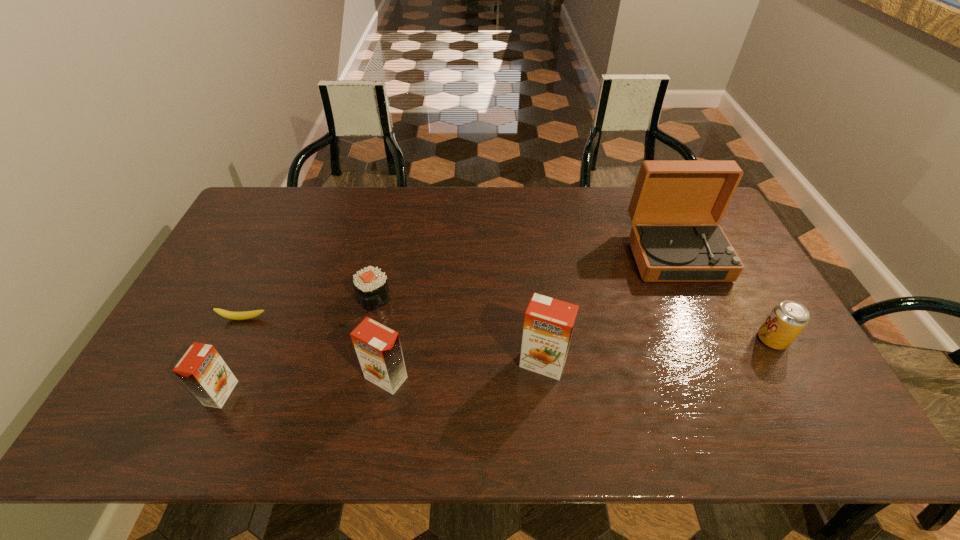
Where is `banana`? This screenshot has width=960, height=540. banana is located at coordinates (245, 315).

Where is `the third farthest object`? The image size is (960, 540). the third farthest object is located at coordinates (245, 315).

Where is `free region located on the back of the leftmost orange juice`? Image resolution: width=960 pixels, height=540 pixels. free region located on the back of the leftmost orange juice is located at coordinates (269, 288).

Identify the location of free space located on the left of the second orange juice from left to right. (254, 377).

Identify the location of blank space located on the left of the third object from right to left. This screenshot has height=540, width=960. (431, 363).

Identify the location of vacant space located 0.310m on the face of the phonograph record. (731, 376).

You are a GUI agent. You are given a task and a screenshot of the screen. Output one action in this format:
    pyautogui.click(x=<x>, y=<y>)
    Task: Click on the free location located on the back of the fifth tallest object
    
    Given the screenshot: What is the action you would take?
    [x=715, y=238]

Locate an element on the screen. vacant space located 0.190m on the back of the sushi is located at coordinates (387, 242).

Find the location of a particular element. Image resolution: width=960 pixels, height=540 pixels. free space located on the upward curve of the fifth nearest object is located at coordinates (235, 337).

Locate an element on the screen. object that is at the left edge is located at coordinates (245, 315).